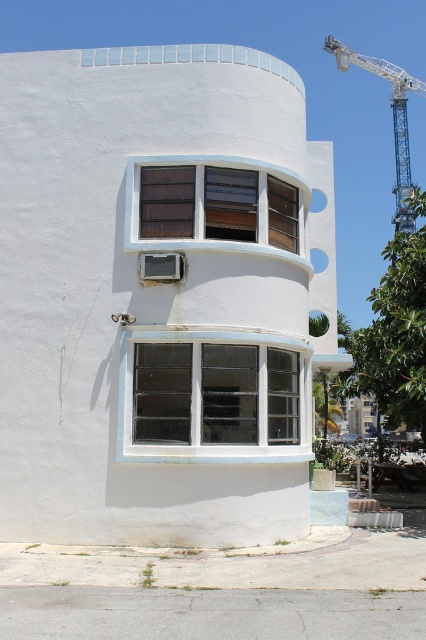
Question: Is white textured glass window at center thinner than brown wood window at center?

Choices:
 (A) yes
 (B) no

Answer: (B)

Question: Which is nearer to the blue metallic crane at upper right?

Choices:
 (A) white textured glass window at center
 (B) brown wood window at center

Answer: (B)

Question: Does white textured glass window at center appear under blue metallic crane at upper right?

Choices:
 (A) no
 (B) yes

Answer: (B)

Question: Does brown wood window at center have a greater width compared to blue metallic crane at upper right?

Choices:
 (A) yes
 (B) no

Answer: (B)

Question: Which point is closer to the camera taking this photo?

Choices:
 (A) (250, 208)
 (B) (402, 81)

Answer: (A)

Question: Among these objects, which one is farthest from the camera?

Choices:
 (A) blue metallic crane at upper right
 (B) brown wood window at center
 (C) white textured glass window at center

Answer: (A)